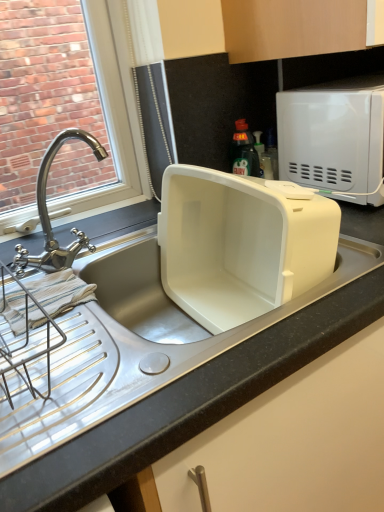
Question: Is polished chrome faucet at left surrounding white matte microwave at upper right?

Choices:
 (A) yes
 (B) no

Answer: (B)

Question: Is polished chrome faucet at left next to white matte microwave at upper right?

Choices:
 (A) yes
 (B) no

Answer: (B)

Question: Is polished chrome faucet at left at the right side of white matte microwave at upper right?

Choices:
 (A) yes
 (B) no

Answer: (B)

Question: Is polished chrome faucet at left completely or partially outside of white matte microwave at upper right?

Choices:
 (A) no
 (B) yes

Answer: (B)

Question: Is polished chrome faucet at left oriented towards white matte microwave at upper right?

Choices:
 (A) no
 (B) yes

Answer: (A)

Question: From a real-world perspective, is polished chrome faucet at left physically above white matte microwave at upper right?

Choices:
 (A) yes
 (B) no

Answer: (A)

Question: Can you confirm if white matte microwave at upper right is bigger than polished chrome faucet at left?

Choices:
 (A) no
 (B) yes

Answer: (B)

Question: Is white matte microwave at upper right at the right side of polished chrome faucet at left?

Choices:
 (A) yes
 (B) no

Answer: (A)

Question: Does white matte microwave at upper right have a greater height compared to polished chrome faucet at left?

Choices:
 (A) yes
 (B) no

Answer: (B)

Question: Is white matte microwave at upper right looking in the opposite direction of polished chrome faucet at left?

Choices:
 (A) yes
 (B) no

Answer: (B)

Question: Does white matte microwave at upper right have a greater width compared to polished chrome faucet at left?

Choices:
 (A) no
 (B) yes

Answer: (B)

Question: Can you confirm if white matte microwave at upper right is positioned to the left of polished chrome faucet at left?

Choices:
 (A) no
 (B) yes

Answer: (A)

Question: Relative to white matte microwave at upper right, is polished chrome faucet at left in front or behind?

Choices:
 (A) front
 (B) behind

Answer: (A)